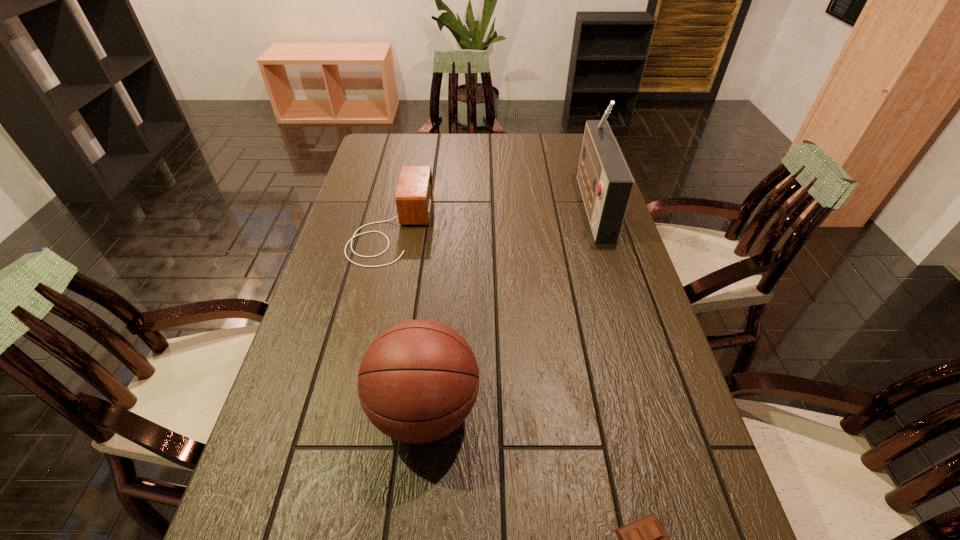
Image resolution: width=960 pixels, height=540 pixels. In order to click on vacant space located on the front-facing side of the shorter radio receiver in this screenshot , I will do pyautogui.click(x=474, y=227).

This screenshot has height=540, width=960. Find the location of `object present at the left edge`. object present at the left edge is located at coordinates (414, 194).

Locate an element on the screen. This screenshot has width=960, height=540. object situated at the right edge is located at coordinates (605, 182).

At what (x,y) coordinates should I click in order to perform the action: click on vacant space at the far edge of the desktop. Please return your answer as a coordinate pair (x, y). The height and width of the screenshot is (540, 960). Looking at the image, I should click on (531, 157).

This screenshot has height=540, width=960. In the image, there is a desktop. In order to click on vacant space at the left edge in this screenshot , I will do `click(370, 202)`.

In the image, there is a desktop. At what (x,y) coordinates should I click in order to perform the action: click on free space at the right edge. Please return your answer as a coordinate pair (x, y). This screenshot has width=960, height=540. Looking at the image, I should click on (648, 389).

In the image, there is a desktop. In order to click on vacant space at the far left corner in this screenshot , I will do `click(389, 140)`.

At what (x,y) coordinates should I click in order to perform the action: click on free space between the taller radio receiver and the third farthest object. Please return your answer as a coordinate pair (x, y). Looking at the image, I should click on (509, 307).

This screenshot has height=540, width=960. I want to click on free spot between the tallest object and the second tallest object, so click(x=509, y=307).

Locate an element on the screen. This screenshot has height=540, width=960. vacant space in between the third farthest object and the shorter radio receiver is located at coordinates (408, 319).